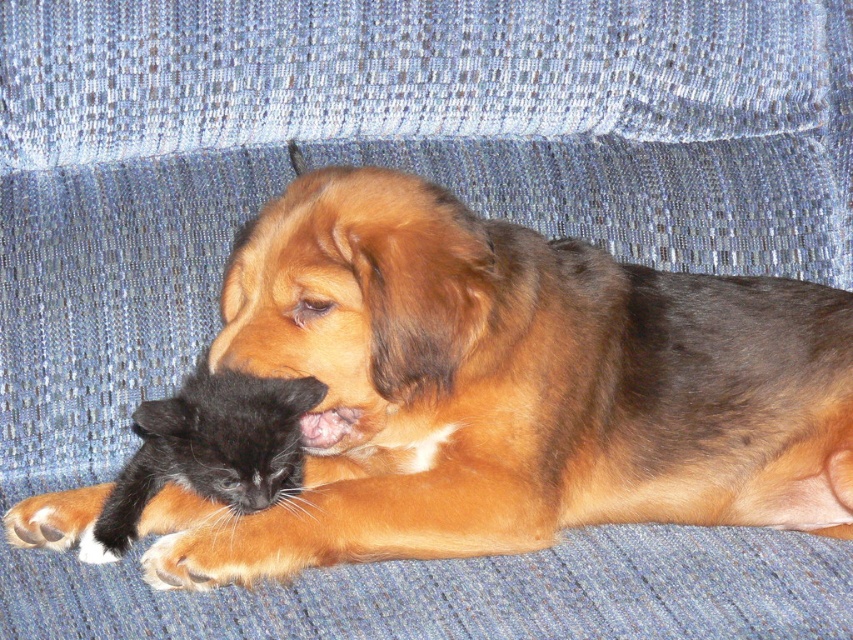
You are a photographer trying to capture the brown fur dog at center. If the camera focuses on the center point of the image, which is at coordinates 0.5, 0.5, will the dog be in focus?

The brown fur dog at center is located at point (508, 388), which is slightly offset from the center coordinates (426, 320). Therefore, the dog may not be in focus if the camera focuses only on the exact center point.